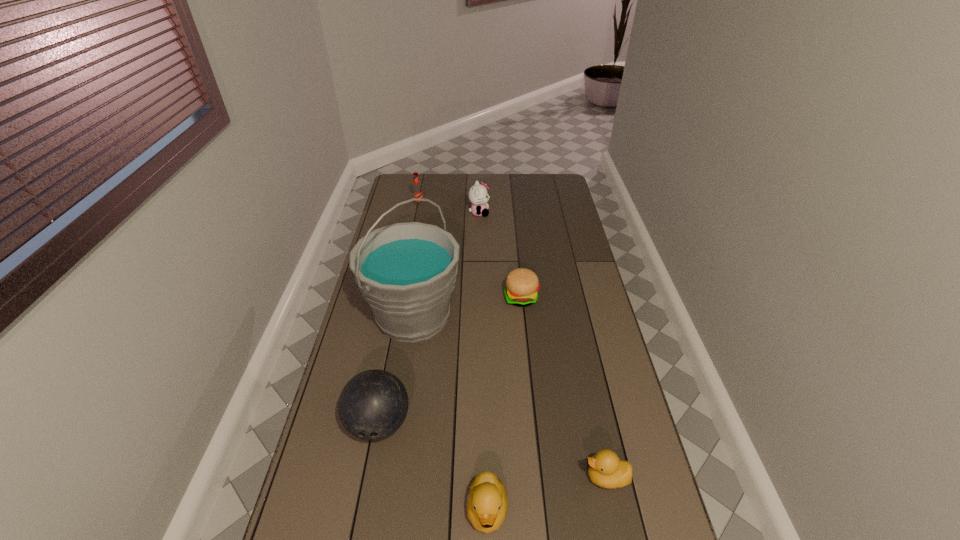
Locate an element on the screen. This screenshot has width=960, height=540. blank space at the near edge is located at coordinates (536, 518).

This screenshot has height=540, width=960. In the image, there is a desktop. In order to click on vacant space at the left edge in this screenshot , I will do `click(352, 374)`.

Find the location of `free space at the right edge of the desktop`. free space at the right edge of the desktop is located at coordinates pos(544,219).

I want to click on free region at the far right corner of the desktop, so click(x=538, y=185).

Where is `unoccupied area between the sixth object from left to right and the root beer`? The image size is (960, 540). unoccupied area between the sixth object from left to right and the root beer is located at coordinates pyautogui.click(x=470, y=252).

Identify the location of vacant point located between the kitten and the shorter duckling. (542, 345).

I want to click on vacant region between the bowling ball and the second object from right to left, so click(x=450, y=361).

You are a GUI agent. You are given a task and a screenshot of the screen. Output one action in this format:
    pyautogui.click(x=<x>, y=<y>)
    Task: Click on the vacant space that's between the kitten and the second object from right to left
    This screenshot has width=960, height=540.
    Given the screenshot: What is the action you would take?
    pyautogui.click(x=500, y=255)

Find the location of a particular element. blank region between the right duckling and the kitten is located at coordinates (542, 345).

Identify the location of unoccupied area between the shorter duckling and the tallest object. The width and height of the screenshot is (960, 540). (510, 397).